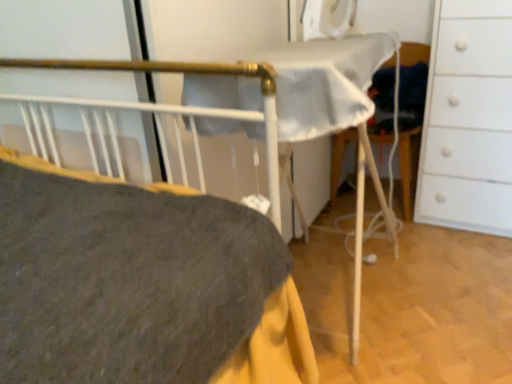
You are a GUI agent. You are given a task and a screenshot of the screen. Output one action in this format:
    pyautogui.click(x=<x>, y=<y>)
    Task: Click on the space that is in front of white fabric folding chair at center
    
    Given the screenshot: What is the action you would take?
    pyautogui.click(x=392, y=242)